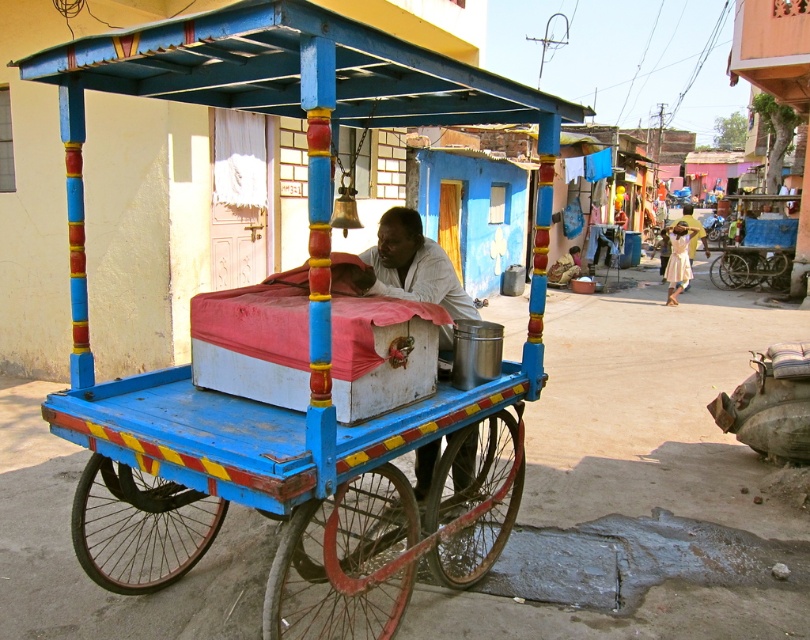
Which is below, wooden cart at center or white matte cart at center?

wooden cart at center is lower down.

Between wooden cart at center and white matte cart at center, which one is positioned higher?

white matte cart at center is higher up.

Where is `wooden cart at center`? The width and height of the screenshot is (810, 640). wooden cart at center is located at coordinates (293, 340).